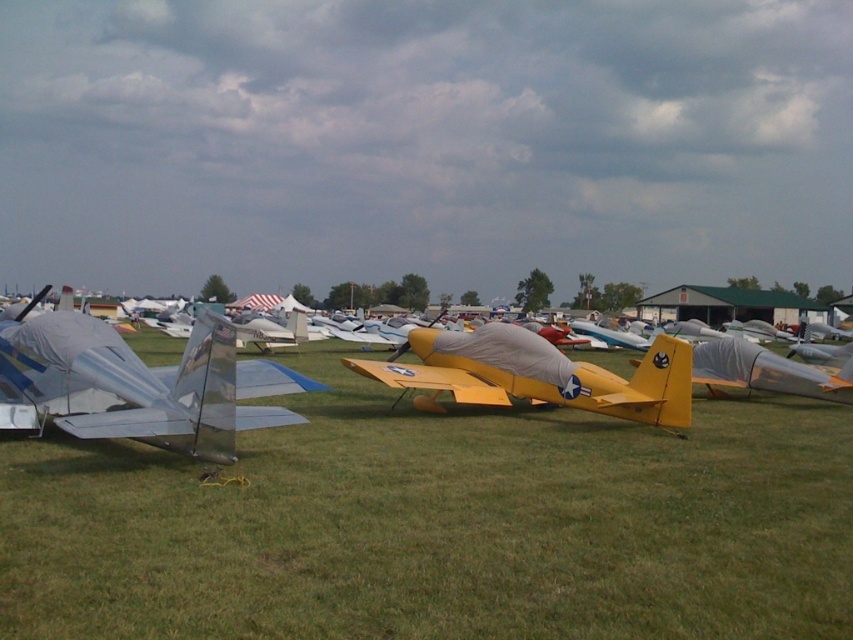
How far apart are metallic silver airplane at center and shiny silver airplane at left?

22.89 inches

Can you confirm if metallic silver airplane at center is wider than shiny silver airplane at left?

Yes, metallic silver airplane at center is wider than shiny silver airplane at left.

Does point (27, 368) come behind point (82, 417)?

That is True.

At what (x,y) coordinates should I click in order to perform the action: click on metallic silver airplane at center. Please return your answer as a coordinate pair (x, y). Looking at the image, I should click on (136, 384).

Can you confirm if metallic silver airplane at center is taller than yellow matte airplane at center?

Correct, metallic silver airplane at center is much taller as yellow matte airplane at center.

Does metallic silver airplane at center appear on the right side of yellow matte airplane at center?

No, metallic silver airplane at center is not to the right of yellow matte airplane at center.

Based on the photo, who is more forward, (207, 428) or (665, 387)?

Positioned in front is point (207, 428).

Locate an element on the screen. Image resolution: width=853 pixels, height=640 pixels. metallic silver airplane at center is located at coordinates (136, 384).

Does green grass at center have a greater width compared to metallic silver airplane at center?

No.

Who is positioned more to the left, green grass at center or metallic silver airplane at center?

metallic silver airplane at center

Is point (148, 493) farther from viewer compared to point (198, 364)?

No, (148, 493) is in front of (198, 364).

Locate an element on the screen. The width and height of the screenshot is (853, 640). green grass at center is located at coordinates (440, 525).